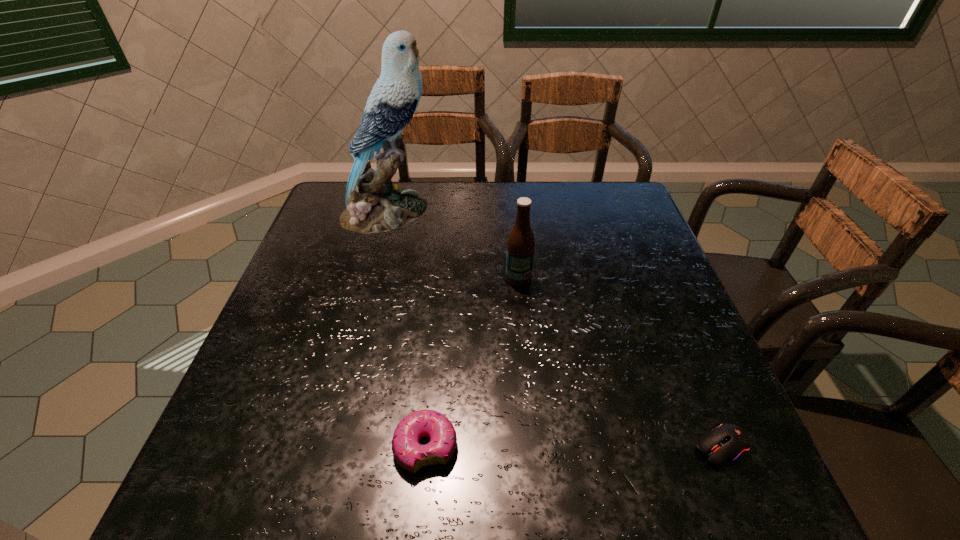
Locate an element on the screen. the tallest object is located at coordinates 373,205.

Locate an element on the screen. Image resolution: width=960 pixels, height=540 pixels. parakeet is located at coordinates (373, 205).

At what (x,y) coordinates should I click in order to perform the action: click on the third nearest object. Please return your answer as a coordinate pair (x, y). The height and width of the screenshot is (540, 960). Looking at the image, I should click on (521, 243).

What are the coordinates of `beer bottle` in the screenshot? It's located at (521, 243).

Image resolution: width=960 pixels, height=540 pixels. In order to click on doughnut in this screenshot , I will do `click(412, 456)`.

Find the location of a particular element. The height and width of the screenshot is (540, 960). the shortest object is located at coordinates (x=726, y=443).

The width and height of the screenshot is (960, 540). What are the coordinates of `the rightmost object` in the screenshot? It's located at (726, 443).

This screenshot has height=540, width=960. Find the location of `blank space located 0.280m on the face of the parakeet`. blank space located 0.280m on the face of the parakeet is located at coordinates (527, 212).

Locate an element on the screen. blank space located on the left of the third object from left to right is located at coordinates (388, 279).

Locate an element on the screen. Image resolution: width=960 pixels, height=540 pixels. free space located 0.050m on the right of the doughnut is located at coordinates (486, 447).